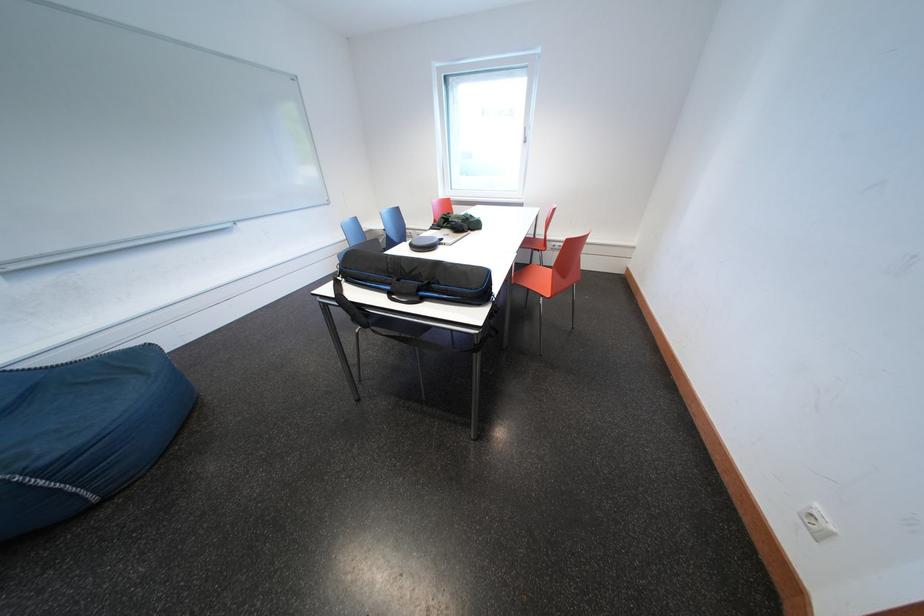
Where is `orange chair sitting surface`? The image size is (924, 616). orange chair sitting surface is located at coordinates (533, 278).